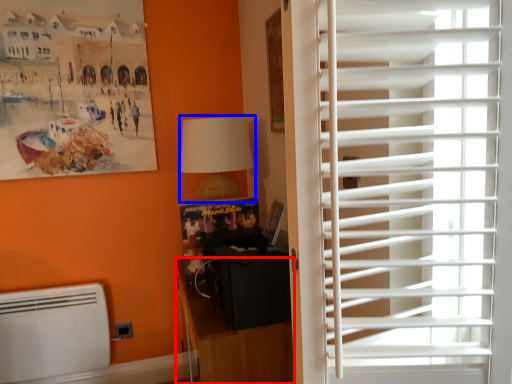
Question: Which object appears closest to the camera in this image, furniture (highlighted by a red box) or lamp (highlighted by a blue box)?

Choices:
 (A) furniture
 (B) lamp

Answer: (A)